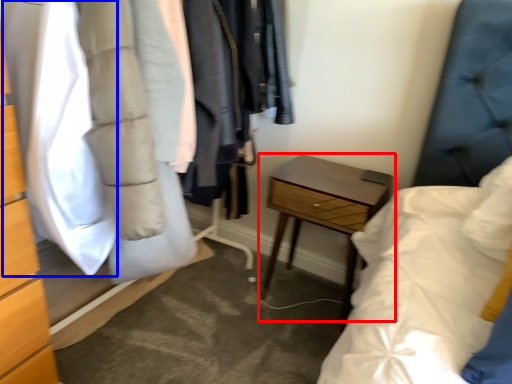
Question: Which object is closer to the camera taking this photo, nightstand (highlighted by a red box) or clothing (highlighted by a blue box)?

Choices:
 (A) nightstand
 (B) clothing

Answer: (B)